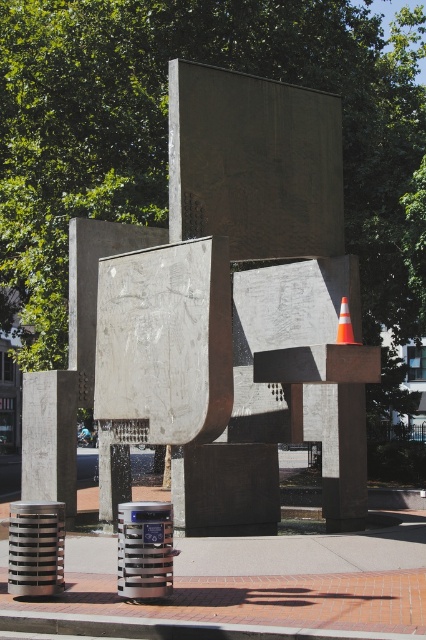
Measure the distance between smooth concrete sculpture at center and orange reflective cone at center.

smooth concrete sculpture at center and orange reflective cone at center are 1.80 meters apart from each other.

Where is `smooth concrete sculpture at center`? smooth concrete sculpture at center is located at coordinates (235, 310).